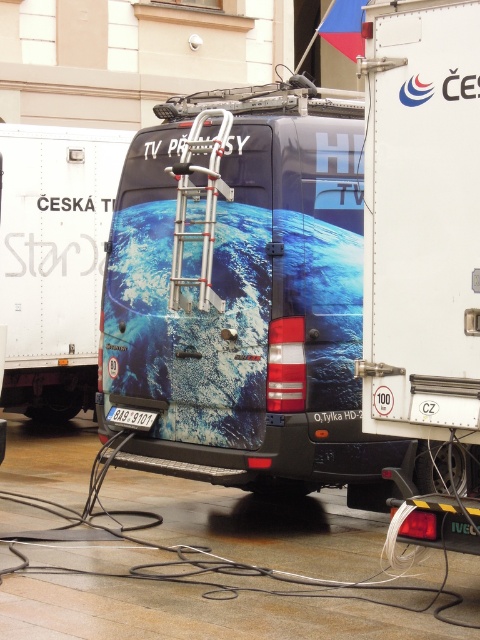
Between metallic silver ladder at center and aluminum ladder at center, which one has less height?

With less height is aluminum ladder at center.

Does metallic silver ladder at center have a larger size compared to aluminum ladder at center?

Indeed, metallic silver ladder at center has a larger size compared to aluminum ladder at center.

Image resolution: width=480 pixels, height=640 pixels. In order to click on metallic silver ladder at center in this screenshot , I will do `click(245, 305)`.

Who is shorter, white matte truck at right or metallic blue van at center?

metallic blue van at center is shorter.

Consider the image. Between white matte truck at right and metallic blue van at center, which one appears on the left side from the viewer's perspective?

metallic blue van at center

Between point (457, 193) and point (64, 365), which one is positioned behind?

Positioned behind is point (64, 365).

At what (x,y) coordinates should I click in order to perform the action: click on white matte truck at right. Please return your answer as a coordinate pair (x, y). The width and height of the screenshot is (480, 640). Looking at the image, I should click on (423, 252).

Does point (459, 532) lie behind point (210, 164)?

That is False.

Find the location of a particular element. The height and width of the screenshot is (640, 480). white matte truck at right is located at coordinates (423, 252).

Does point (470, 356) lie in front of point (219, 125)?

Yes.

Locate an element on the screen. white matte truck at right is located at coordinates (423, 252).